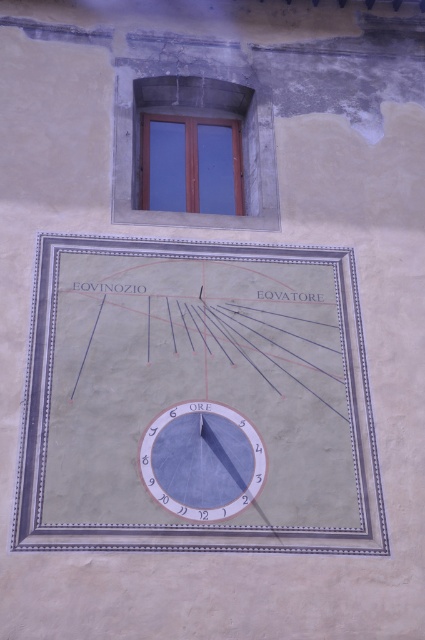
Question: Is matte gray clock at center bigger than wooden window at upper center?

Choices:
 (A) yes
 (B) no

Answer: (B)

Question: Is the position of matte gray clock at center more distant than that of wooden window at upper center?

Choices:
 (A) no
 (B) yes

Answer: (A)

Question: Among these objects, which one is nearest to the camera?

Choices:
 (A) matte gray clock at center
 (B) wooden window at upper center

Answer: (A)

Question: Where is matte gray clock at center located in relation to wooden window at upper center in the image?

Choices:
 (A) left
 (B) right

Answer: (B)

Question: Which point is farther to the camera?

Choices:
 (A) (254, 474)
 (B) (159, 88)

Answer: (B)